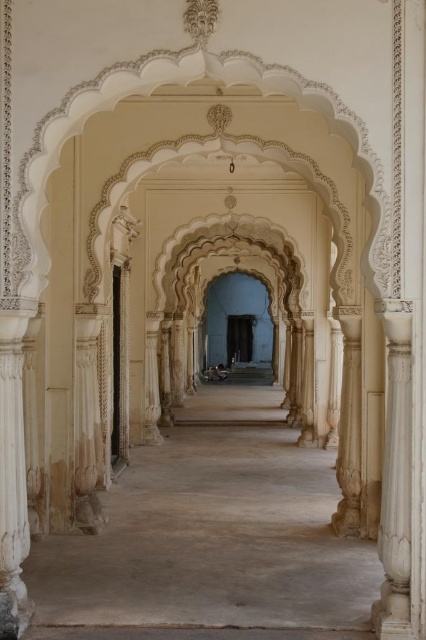
Question: Can you confirm if smooth sandstone corridor at center is wider than white marble column at right?

Choices:
 (A) no
 (B) yes

Answer: (B)

Question: Which object is closer to the camera taking this photo?

Choices:
 (A) smooth sandstone corridor at center
 (B) white marble column at right

Answer: (B)

Question: Which of the following is the closest to the observer?

Choices:
 (A) (213, 451)
 (B) (382, 524)

Answer: (B)

Question: Can you confirm if smooth sandstone corridor at center is bigger than white marble column at right?

Choices:
 (A) yes
 (B) no

Answer: (A)

Question: Does smooth sandstone corridor at center have a greater width compared to white marble column at right?

Choices:
 (A) no
 (B) yes

Answer: (B)